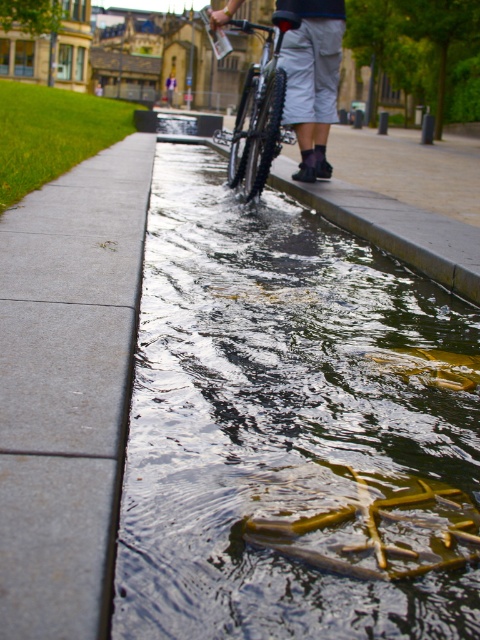
Question: Can you confirm if gray concrete sidewalk at left is positioned above shiny metallic bicycle at center?

Choices:
 (A) yes
 (B) no

Answer: (B)

Question: Estimate the real-world distances between objects in this image. Which object is closer to the clear water at center?

Choices:
 (A) shiny metallic bicycle at center
 (B) gray concrete sidewalk at left

Answer: (B)

Question: Which point is closer to the camera?

Choices:
 (A) clear water at center
 (B) gray concrete sidewalk at left

Answer: (B)

Question: Which point is closer to the camera?

Choices:
 (A) (173, 84)
 (B) (428, 390)
 (C) (82, 486)

Answer: (C)

Question: Is gray concrete sidewalk at left further to camera compared to dark blue jeans at center?

Choices:
 (A) yes
 (B) no

Answer: (B)

Question: Can you confirm if gray concrete sidewalk at left is positioned below dark blue jeans at center?

Choices:
 (A) no
 (B) yes

Answer: (B)